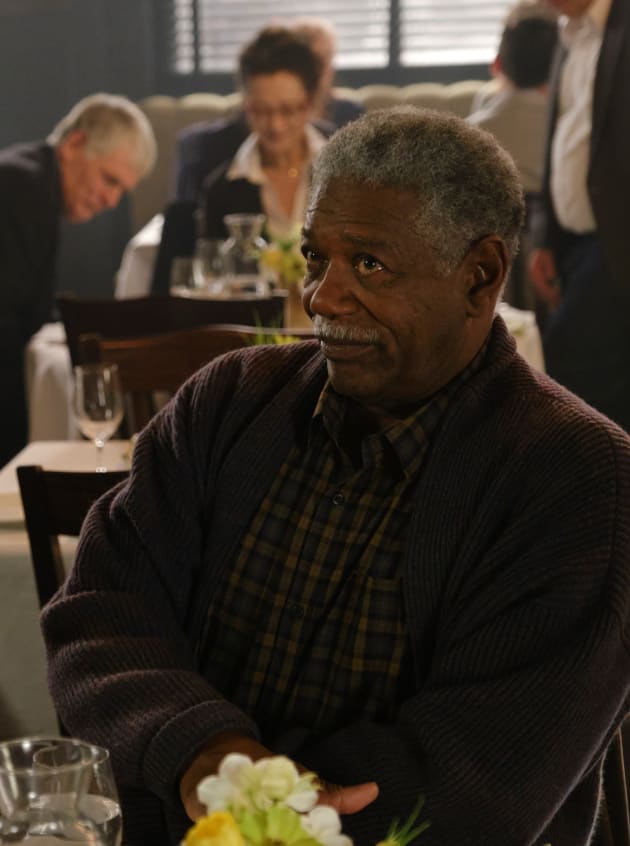
Locate an element on the screen. The image size is (630, 846). white cloth tables is located at coordinates (43, 448), (54, 360), (138, 249).